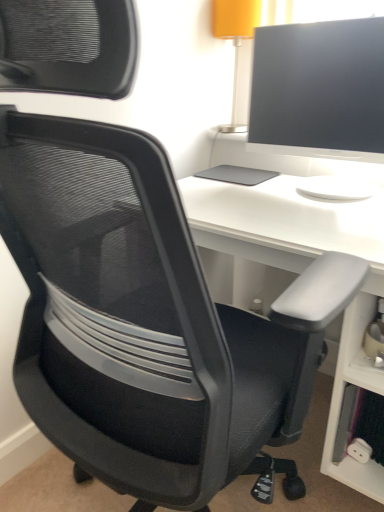
Question: Is matte black monitor at upper right bigger or smaller than white matte desk at center?

Choices:
 (A) big
 (B) small

Answer: (B)

Question: From their relative heights in the image, would you say matte black monitor at upper right is taller or shorter than white matte desk at center?

Choices:
 (A) tall
 (B) short

Answer: (B)

Question: From a real-world perspective, is matte black monitor at upper right above or below white matte desk at center?

Choices:
 (A) above
 (B) below

Answer: (A)

Question: From a real-world perspective, is white matte desk at center above or below matte black monitor at upper right?

Choices:
 (A) below
 (B) above

Answer: (A)

Question: From the image's perspective, is white matte desk at center located above or below matte black monitor at upper right?

Choices:
 (A) below
 (B) above

Answer: (A)

Question: Is white matte desk at center wider or thinner than matte black monitor at upper right?

Choices:
 (A) thin
 (B) wide

Answer: (B)

Question: Is white matte desk at center in front of or behind matte black monitor at upper right in the image?

Choices:
 (A) front
 (B) behind

Answer: (A)